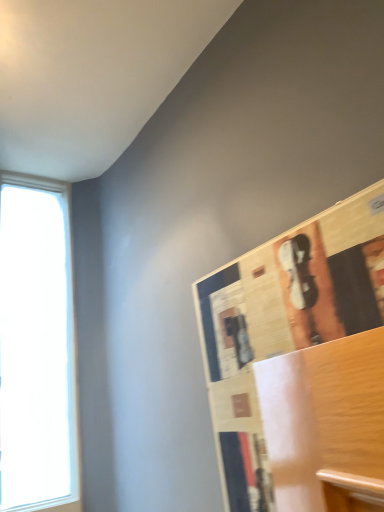
Question: Is point (69, 281) positioned closer to the camera than point (249, 472)?

Choices:
 (A) closer
 (B) farther

Answer: (B)

Question: Is transparent glass window at left inside or outside of wooden bulletin board at upper right?

Choices:
 (A) outside
 (B) inside

Answer: (A)

Question: Considering the positions of transparent glass window at left and wooden bulletin board at upper right in the image, is transparent glass window at left bigger or smaller than wooden bulletin board at upper right?

Choices:
 (A) big
 (B) small

Answer: (A)

Question: Is wooden bulletin board at upper right taller or shorter than transparent glass window at left?

Choices:
 (A) tall
 (B) short

Answer: (B)

Question: From the image's perspective, is wooden bulletin board at upper right above or below transparent glass window at left?

Choices:
 (A) below
 (B) above

Answer: (B)

Question: From a real-world perspective, relative to transparent glass window at left, is wooden bulletin board at upper right vertically above or below?

Choices:
 (A) below
 (B) above

Answer: (A)

Question: Looking at the image, does wooden bulletin board at upper right seem bigger or smaller compared to transparent glass window at left?

Choices:
 (A) small
 (B) big

Answer: (A)